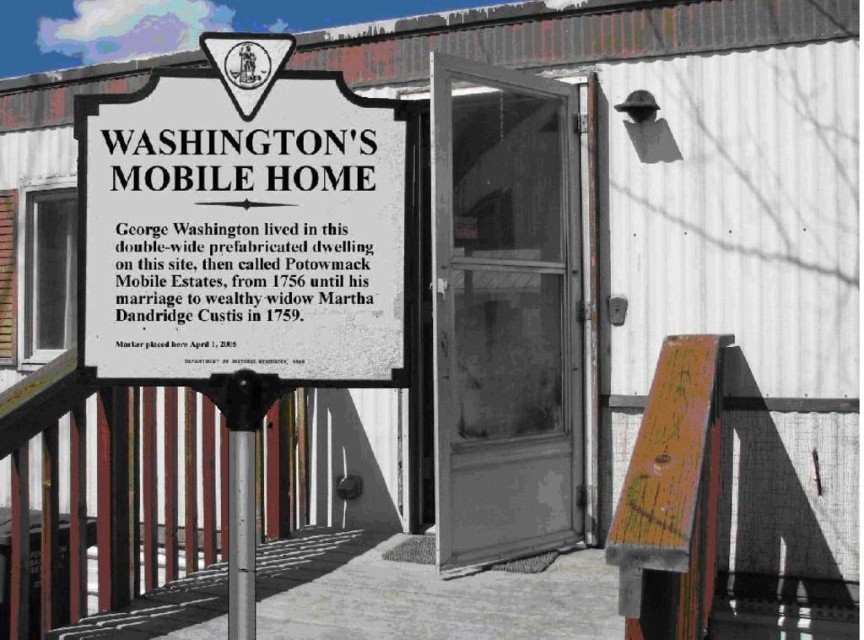
Question: Is wooden painted bench at lower right smaller than silver metallic pole at left?

Choices:
 (A) no
 (B) yes

Answer: (A)

Question: Which object is farther from the camera taking this photo?

Choices:
 (A) wooden painted bench at lower right
 (B) silver metallic pole at left

Answer: (A)

Question: Is wooden painted bench at lower right wider than silver metallic pole at left?

Choices:
 (A) yes
 (B) no

Answer: (A)

Question: Which point is farther from the camera taking this photo?

Choices:
 (A) (666, 561)
 (B) (240, 513)

Answer: (A)

Question: Can you confirm if white paper sign at upper left is thinner than silver metallic pole at left?

Choices:
 (A) yes
 (B) no

Answer: (B)

Question: Which object is closer to the camera taking this photo?

Choices:
 (A) wooden painted bench at lower right
 (B) silver metallic pole at left
 (C) white paper sign at upper left

Answer: (C)